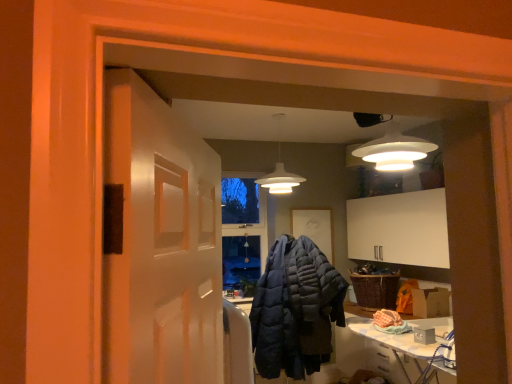
In order to face white ironing board at lower right, should I rotate leftwards or rightwards?

Rotate right and turn 20.248 degrees.

The height and width of the screenshot is (384, 512). Identify the location of woven brown basket at lower right. (375, 290).

What do you see at coordinates (159, 242) in the screenshot?
I see `white glossy door at center` at bounding box center [159, 242].

Locate an element on the screen. white ironing board at lower right is located at coordinates (403, 342).

What's the angular difference between dark blue quilted jacket at center and white matte pendant light at center's facing directions?

There is a 3.1-degree angle between the facing directions of dark blue quilted jacket at center and white matte pendant light at center.

Find the location of a particular element. jacket on the right of white matte pendant light at center is located at coordinates (295, 309).

Which of these two, dark blue quilted jacket at center or white matte pendant light at center, is wider?

dark blue quilted jacket at center.

Considering the relative positions of dark blue quilted jacket at center and white matte pendant light at center in the image provided, is dark blue quilted jacket at center behind white matte pendant light at center?

No, the depth of dark blue quilted jacket at center is less than that of white matte pendant light at center.

Consider the image. Is woven brown basket at lower right a part of white glossy door at center?

No, woven brown basket at lower right is located outside of white glossy door at center.

Find the location of `basket directly beneath the white glossy door at center (from a real-world perspective)`. basket directly beneath the white glossy door at center (from a real-world perspective) is located at coordinates (375, 290).

From a real-world perspective, which object rests below the other?

From a 3D spatial view, woven brown basket at lower right is below.

From the image's perspective, who appears lower, white glossy door at center or woven brown basket at lower right?

woven brown basket at lower right is shown below in the image.

Would you say woven brown basket at lower right is a long distance from dark blue quilted jacket at center?

They are positioned close to each other.

Who is smaller, woven brown basket at lower right or dark blue quilted jacket at center?

woven brown basket at lower right.

Locate an element on the screen. basket on the right of dark blue quilted jacket at center is located at coordinates (375, 290).

Does white glossy door at center have a smaller size compared to dark blue quilted jacket at center?

Correct, white glossy door at center occupies less space than dark blue quilted jacket at center.

Between white glossy door at center and dark blue quilted jacket at center, which one has more height?

Standing taller between the two is dark blue quilted jacket at center.

Which point is more forward, (x=152, y=207) or (x=285, y=352)?

Point (x=152, y=207)

In the scene shown: Between dark blue quilted jacket at center and white glossy door at center, which one has larger width?

Wider between the two is dark blue quilted jacket at center.

Identify the location of door located above the dark blue quilted jacket at center (from the image's perspective). (159, 242).

Can you confirm if dark blue quilted jacket at center is taller than white glossy door at center?

Yes, dark blue quilted jacket at center is taller than white glossy door at center.

Is dark blue quilted jacket at center looking in the opposite direction of white glossy door at center?

No, white glossy door at center is not at the back of dark blue quilted jacket at center.

Which is in front, point (308, 347) or point (398, 351)?

Positioned in front is point (398, 351).

Is white ironing board at lower right inside dark blue quilted jacket at center?

No, dark blue quilted jacket at center does not contain white ironing board at lower right.

Considering the relative sizes of dark blue quilted jacket at center and white ironing board at lower right in the image provided, is dark blue quilted jacket at center bigger than white ironing board at lower right?

Actually, dark blue quilted jacket at center might be smaller than white ironing board at lower right.

Between white glossy door at center and white matte pendant light at center, which one is positioned behind?

white matte pendant light at center is further from the camera.

From a real-world perspective, is white glossy door at center physically located above or below white matte pendant light at center?

In terms of real-world spatial position, white glossy door at center is below white matte pendant light at center.

Based on the photo, is white glossy door at center not inside white matte pendant light at center?

Yes.

Locate an element on the screen. This screenshot has width=512, height=384. lighting above the dark blue quilted jacket at center (from the image's perspective) is located at coordinates pos(280,169).

Where is `basket that appears below the white glossy door at center (from the image's perspective)`? The image size is (512, 384). basket that appears below the white glossy door at center (from the image's perspective) is located at coordinates (375, 290).

Considering their positions, is white ironing board at lower right positioned further to woven brown basket at lower right than dark blue quilted jacket at center?

dark blue quilted jacket at center lies further to woven brown basket at lower right than the other object.

Estimate the real-world distances between objects in this image. Which object is further from white matte pendant light at center, woven brown basket at lower right or white ironing board at lower right?

white ironing board at lower right is further to white matte pendant light at center.

From the image, which object appears to be nearer to white glossy door at center, dark blue quilted jacket at center or white ironing board at lower right?

white ironing board at lower right is closer to white glossy door at center.

From the image, which object appears to be farther from white glossy door at center, white matte pendant light at center or white ironing board at lower right?

The object further to white glossy door at center is white matte pendant light at center.

Based on their spatial positions, is white ironing board at lower right or woven brown basket at lower right closer to white glossy door at center?

Among the two, white ironing board at lower right is located nearer to white glossy door at center.

Based on their spatial positions, is woven brown basket at lower right or white matte pendant light at center closer to dark blue quilted jacket at center?

woven brown basket at lower right is positioned closer to the anchor dark blue quilted jacket at center.

Estimate the real-world distances between objects in this image. Which object is closer to white ironing board at lower right, white matte pendant light at center or white glossy door at center?

white matte pendant light at center.

Considering their positions, is white ironing board at lower right positioned closer to white glossy door at center than dark blue quilted jacket at center?

white ironing board at lower right is positioned closer to the anchor white glossy door at center.

What are the coordinates of `jacket between white glossy door at center and woven brown basket at lower right in the front-back direction` in the screenshot? It's located at [295, 309].

Locate an element on the screen. basket that lies between white matte pendant light at center and dark blue quilted jacket at center from top to bottom is located at coordinates (375, 290).

Where is `table located between white glossy door at center and white matte pendant light at center in the depth direction`? The width and height of the screenshot is (512, 384). table located between white glossy door at center and white matte pendant light at center in the depth direction is located at coordinates (403, 342).

What are the coordinates of `jacket between white matte pendant light at center and white ironing board at lower right in the vertical direction` in the screenshot? It's located at (x=295, y=309).